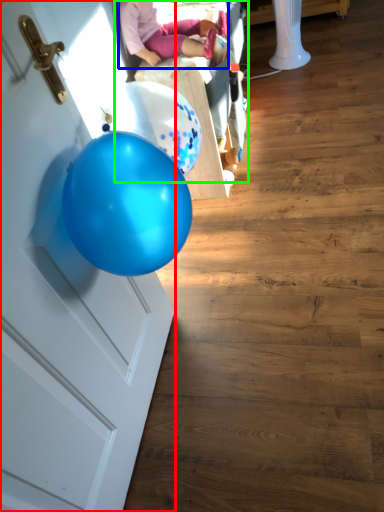
Question: Which object is the farthest from door (highlighted by a red box)? Choose among these: person (highlighted by a blue box) or baby carriage (highlighted by a green box).

Choices:
 (A) person
 (B) baby carriage

Answer: (B)